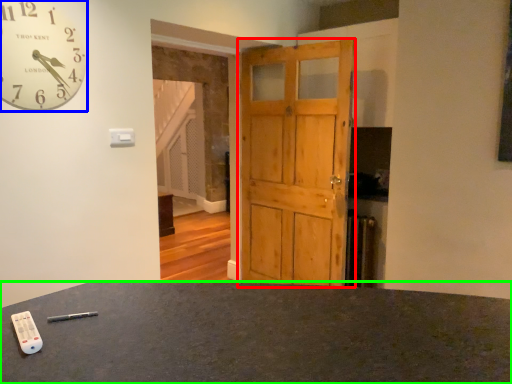
Question: Based on their relative distances, which object is farther from barn door (highlighted by a red box)? Choose from wall clock (highlighted by a blue box) and desk (highlighted by a green box).

Choices:
 (A) wall clock
 (B) desk

Answer: (B)